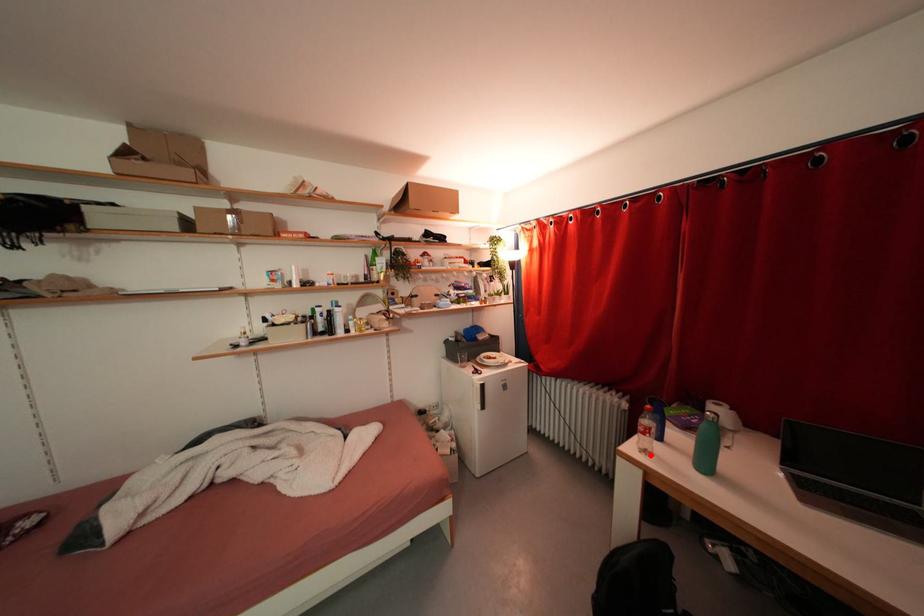
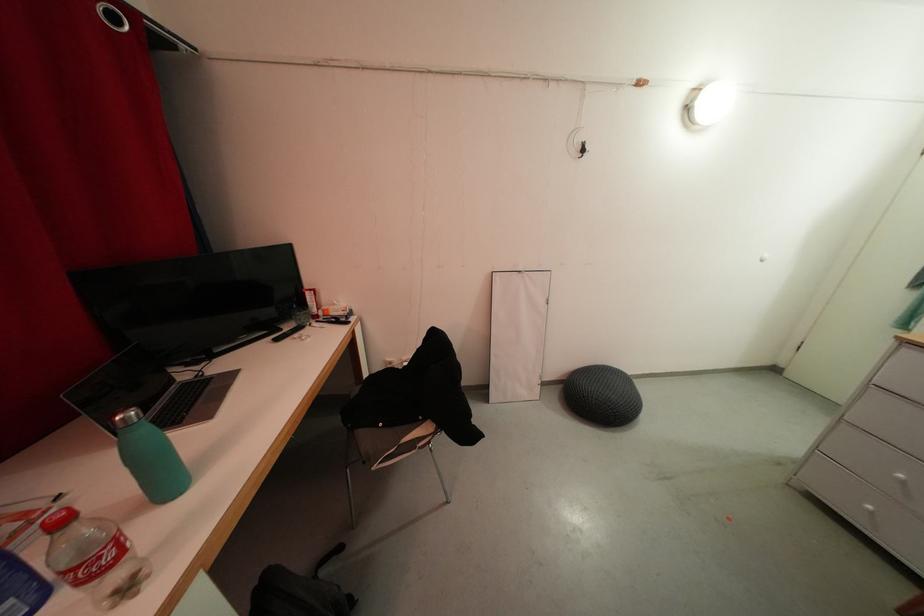
Question: A red point is marked in image1. In image2, is the corresponding 3D point closer to the camera or farther? Reply with the corresponding letter.

Choices:
 (A) The corresponding 3D point is closer.
 (B) The corresponding 3D point is farther.

Answer: (A)